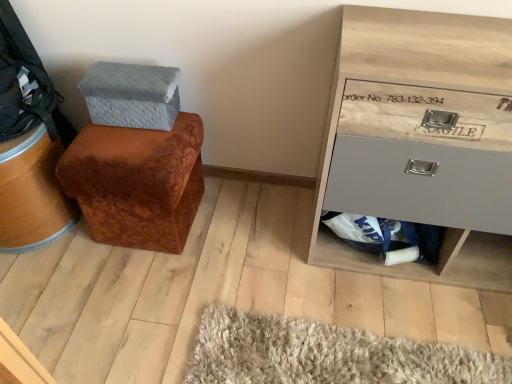
Find the location of a particular element. empty space that is in between wooden drawer at right and brown velvety ottoman at left is located at coordinates (267, 228).